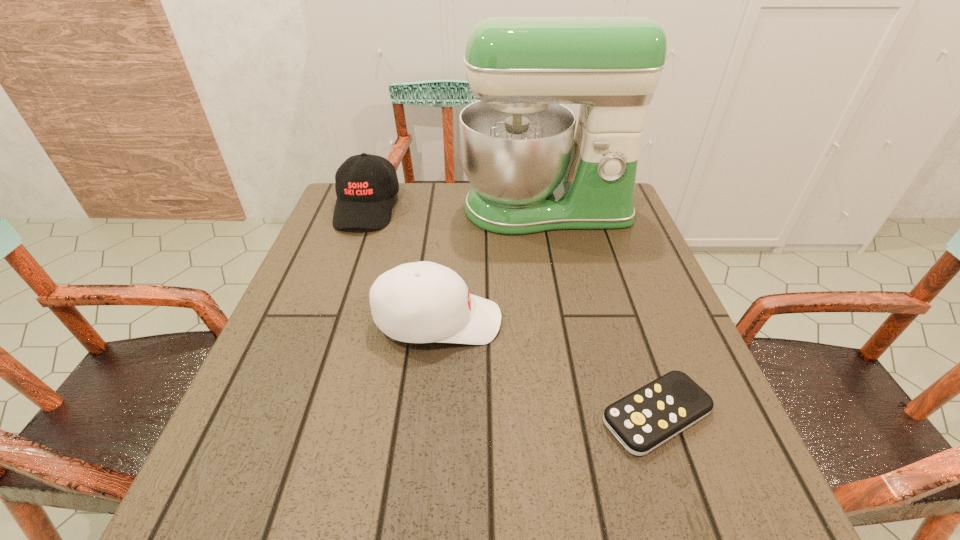
Where is `free spot at the right edge of the desktop`? This screenshot has height=540, width=960. free spot at the right edge of the desktop is located at coordinates (660, 368).

The image size is (960, 540). In order to click on vacant space at the near left corner in this screenshot , I will do `click(230, 475)`.

Where is `empty space that is in between the nearest object and the leftmost object`? The image size is (960, 540). empty space that is in between the nearest object and the leftmost object is located at coordinates (512, 311).

This screenshot has width=960, height=540. Find the location of `free spot between the left baseball cap and the remote control`. free spot between the left baseball cap and the remote control is located at coordinates (512, 311).

I want to click on free spot between the nearest object and the farther baseball cap, so (x=512, y=311).

You are a GUI agent. You are given a task and a screenshot of the screen. Output one action in this format:
    pyautogui.click(x=<x>, y=<y>)
    Task: Click on the vacant region between the nearer baseball cap and the tallest object
    The width and height of the screenshot is (960, 540).
    Given the screenshot: What is the action you would take?
    pyautogui.click(x=492, y=265)

Where is `vacant space that is in between the farther baseball cap and the mixer`? vacant space that is in between the farther baseball cap and the mixer is located at coordinates (456, 208).

You are a GUI agent. You are given a task and a screenshot of the screen. Output one action in this format:
    pyautogui.click(x=<x>, y=<y>)
    Task: Click on the free area in between the farther baseball cap and the mixer
    
    Given the screenshot: What is the action you would take?
    pyautogui.click(x=456, y=208)

The height and width of the screenshot is (540, 960). I want to click on free area in between the left baseball cap and the mixer, so click(x=456, y=208).

This screenshot has height=540, width=960. Identify the location of free space between the right baseball cap and the shortest object. tap(547, 368).